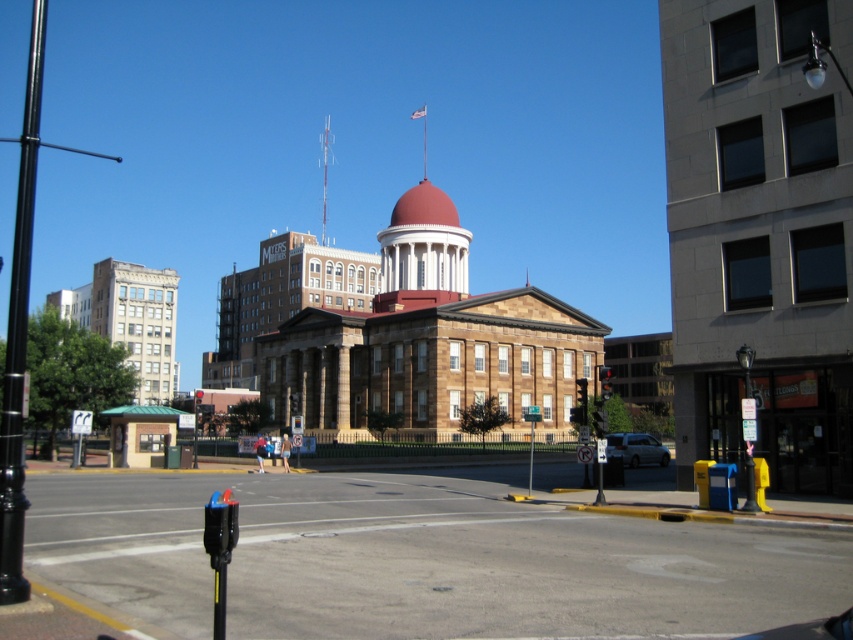
Question: Estimate the real-world distances between objects in this image. Which object is farther from the metallic parking meter at lower left?

Choices:
 (A) black metal pole at left
 (B) silver metallic van at lower right

Answer: (A)

Question: Among these objects, which one is farthest from the camera?

Choices:
 (A) metallic parking meter at lower left
 (B) silver metallic van at lower right

Answer: (B)

Question: Does metallic parking meter at lower left have a lesser width compared to silver metallic van at lower right?

Choices:
 (A) yes
 (B) no

Answer: (B)

Question: Is black metal pole at left thinner than silver metallic van at lower right?

Choices:
 (A) no
 (B) yes

Answer: (A)

Question: Estimate the real-world distances between objects in this image. Which object is farther from the silver metallic van at lower right?

Choices:
 (A) metallic parking meter at lower left
 (B) black metal pole at left

Answer: (B)

Question: Is metallic parking meter at lower left bigger than black metal pole at left?

Choices:
 (A) yes
 (B) no

Answer: (B)